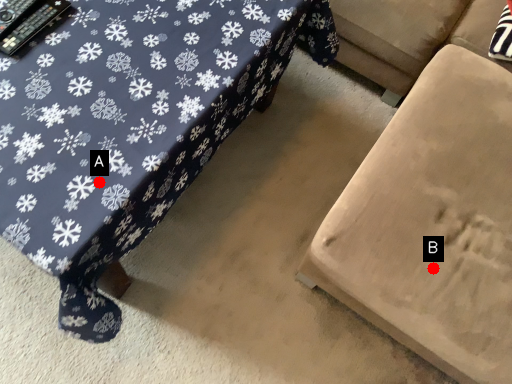
Question: Two points are circled on the image, labeled by A and B beside each circle. Among these points, which one is farthest from the camera?

Choices:
 (A) A is further
 (B) B is further

Answer: (B)